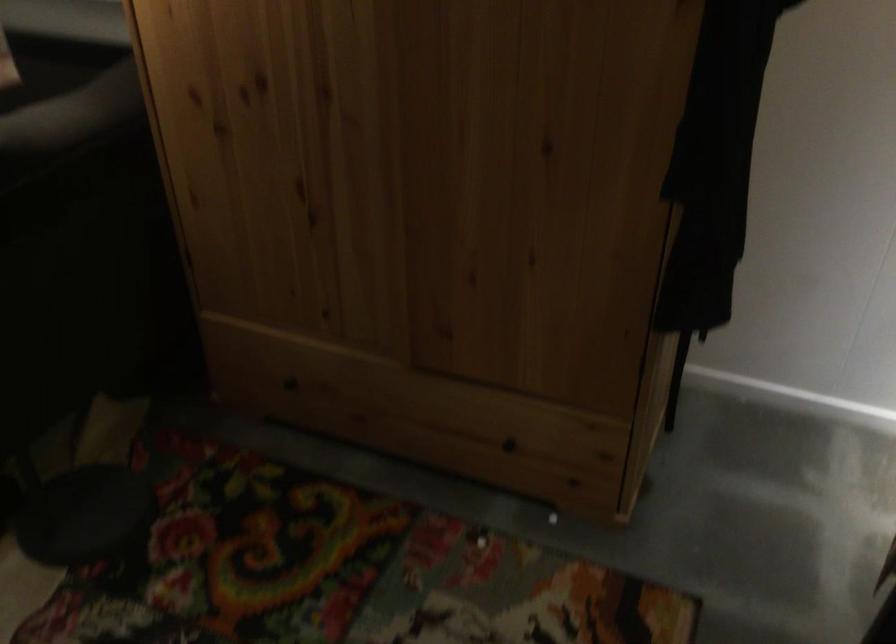
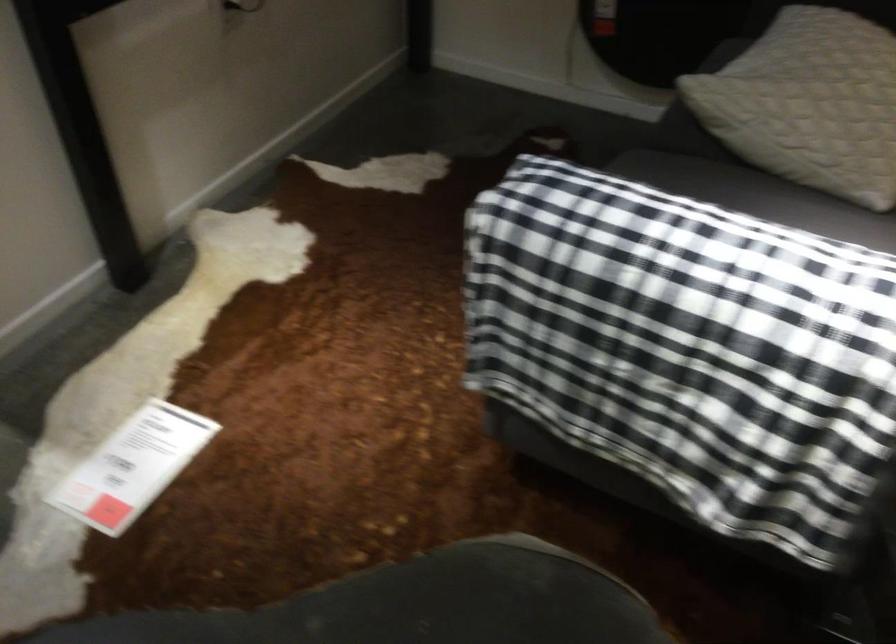
Question: What movement of the cameraman would produce the second image?

Choices:
 (A) Left
 (B) Right
 (C) Forward
 (D) Backward

Answer: (A)